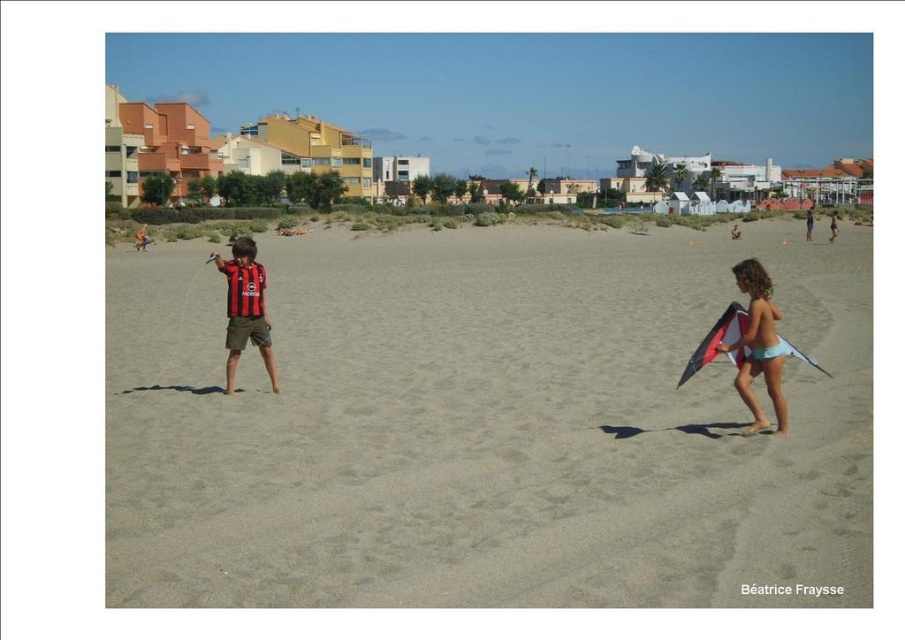
You are a photographer trying to capture the perfect shot of the black jersey at center. You notice a point at coordinates point (245,308). Where exactly is this point located in relation to the black jersey at center?

The point (245,308) is located on the black jersey at center.

You are a beachgoer who wants to place a 1.2 meter tall sandcastle on the smooth sand at center. Can you do that without it being taller than the multicolored fabric kite at right?

The smooth sand at center is taller than the multicolored fabric kite at right. Since the sandcastle is 1.2 meters tall, it would exceed the kite height, so you cannot place it there without violating the height constraint.